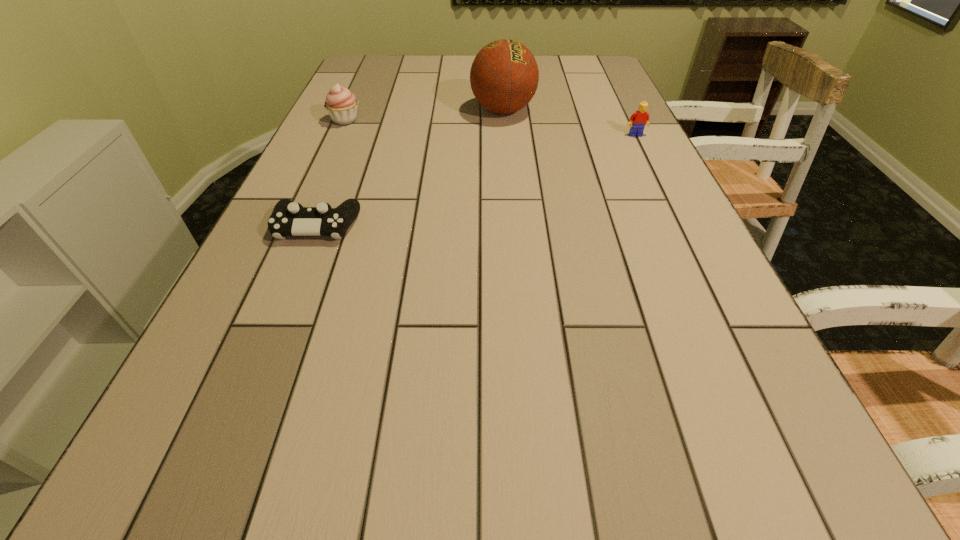
At what (x,y) coordinates should I click in order to perform the action: click on vacant area that lies between the tallest object and the Lego. Please return your answer as a coordinate pair (x, y). Image resolution: width=960 pixels, height=540 pixels. Looking at the image, I should click on (569, 123).

Locate an element on the screen. The image size is (960, 540). vacant space in between the basketball and the cupcake is located at coordinates (424, 116).

Image resolution: width=960 pixels, height=540 pixels. I want to click on free spot between the shortest object and the basketball, so click(x=410, y=168).

Locate an element on the screen. This screenshot has height=540, width=960. free area in between the basketball and the third farthest object is located at coordinates (569, 123).

Identify the location of vacant area between the cupcake and the basketball. (424, 116).

Image resolution: width=960 pixels, height=540 pixels. Find the location of `empty location between the shortest object and the cupcake`. empty location between the shortest object and the cupcake is located at coordinates (331, 173).

I want to click on vacant space that's between the control and the tallest object, so click(410, 168).

The image size is (960, 540). Find the location of `free point between the cupcake and the third farthest object`. free point between the cupcake and the third farthest object is located at coordinates (491, 127).

You are a GUI agent. You are given a task and a screenshot of the screen. Output one action in this format:
    pyautogui.click(x=<x>, y=<y>)
    Task: Click on the blank region between the cupcake and the second object from right to left
    This screenshot has height=540, width=960.
    Given the screenshot: What is the action you would take?
    pyautogui.click(x=424, y=116)

Point out which object is positioned as the second nearest to the cupcake. Please provide its 2D coordinates. Your answer should be formatted as a tuple, i.e. [(x, y)], where the tuple contains the x and y coordinates of a point satisfying the conditions above.

[(288, 218)]